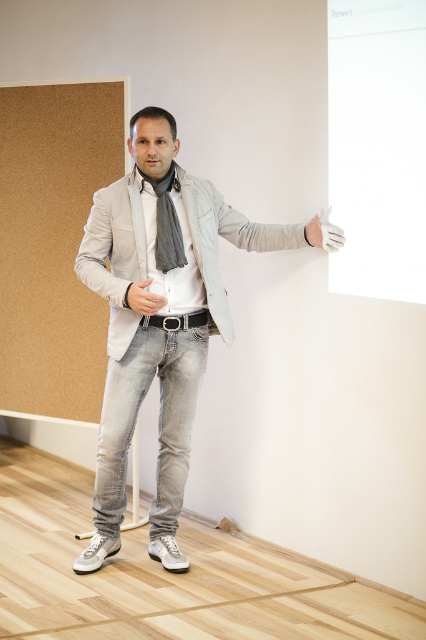
Question: Can you confirm if light gray cotton jacket at center is bigger than white glossy board at upper right?

Choices:
 (A) yes
 (B) no

Answer: (A)

Question: Estimate the real-world distances between objects in this image. Which object is farther from the white glossy board at upper right?

Choices:
 (A) gray fabric scarf at center
 (B) light gray cotton jacket at center
 (C) corkboard at left

Answer: (C)

Question: Can you confirm if corkboard at left is smaller than matte gray glove at center?

Choices:
 (A) no
 (B) yes

Answer: (A)

Question: In this image, where is gray fabric scarf at center located relative to matte gray glove at center?

Choices:
 (A) right
 (B) left

Answer: (A)

Question: Which point is closer to the camera?

Choices:
 (A) corkboard at left
 (B) white glossy board at upper right
 (C) matte gray glove at center

Answer: (B)

Question: Among these objects, which one is farthest from the camera?

Choices:
 (A) white glossy board at upper right
 (B) white matte glove at upper right
 (C) gray fabric scarf at center

Answer: (B)